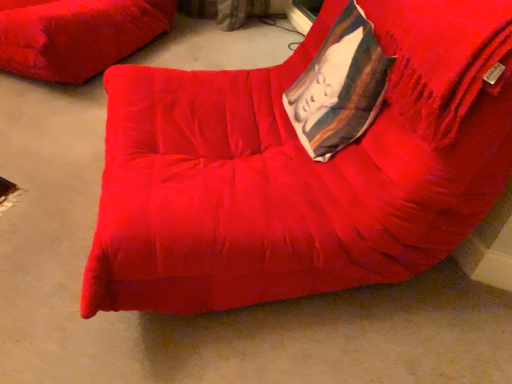
This screenshot has width=512, height=384. I want to click on velvet-like white pillow at upper right, so click(339, 87).

This screenshot has height=384, width=512. What do you see at coordinates (76, 35) in the screenshot? I see `velvet red cushion at upper left, arranged as the 1th furniture when viewed from the back` at bounding box center [76, 35].

Identify the location of velvet-like white pillow at upper right. pos(339,87).

In the scene shown: Is velvet red bean bag chair at center, the 2th furniture in the back-to-front sequence, aimed at velvet red cushion at upper left, which is counted as the 2th furniture, starting from the right?

No.

From a real-world perspective, which is physically below, velvet red bean bag chair at center, marked as the first furniture in a front-to-back arrangement, or velvet red cushion at upper left, which appears as the first furniture when viewed from the left?

velvet red cushion at upper left, which appears as the first furniture when viewed from the left, from a real-world perspective.

Looking at this image, measure the distance between velvet red bean bag chair at center, the 2th furniture in the back-to-front sequence, and velvet red cushion at upper left, which appears as the 2th furniture when viewed from the front.

A distance of 1.15 meters exists between velvet red bean bag chair at center, the 2th furniture in the back-to-front sequence, and velvet red cushion at upper left, which appears as the 2th furniture when viewed from the front.

Does velvet red bean bag chair at center, marked as the 2th furniture in a left-to-right arrangement, have a lesser height compared to velvet red cushion at upper left, arranged as the 1th furniture when viewed from the back?

No.

Is velvet red cushion at upper left, which is counted as the 2th furniture, starting from the right, facing away from velvet-like white pillow at upper right?

velvet red cushion at upper left, which is counted as the 2th furniture, starting from the right, is not turned away from velvet-like white pillow at upper right.

Is velvet red cushion at upper left, which appears as the first furniture when viewed from the left, not near velvet-like white pillow at upper right?

Yes.

From the picture: Considering the positions of objects velvet red cushion at upper left, which is counted as the 2th furniture, starting from the right, and velvet-like white pillow at upper right in the image provided, who is more to the right, velvet red cushion at upper left, which is counted as the 2th furniture, starting from the right, or velvet-like white pillow at upper right?

From the viewer's perspective, velvet-like white pillow at upper right appears more on the right side.

Is velvet red cushion at upper left, arranged as the 1th furniture when viewed from the back, positioned beyond the bounds of velvet-like white pillow at upper right?

Yes, velvet red cushion at upper left, arranged as the 1th furniture when viewed from the back, is located beyond the bounds of velvet-like white pillow at upper right.

From a real-world perspective, which is physically below, velvet-like white pillow at upper right or velvet red bean bag chair at center, which is counted as the 1th furniture, starting from the right?

From a 3D spatial view, velvet red bean bag chair at center, which is counted as the 1th furniture, starting from the right, is below.

Is velvet red bean bag chair at center, which is counted as the 1th furniture, starting from the right, at the back of velvet-like white pillow at upper right?

Correct, velvet-like white pillow at upper right is looking away from velvet red bean bag chair at center, which is counted as the 1th furniture, starting from the right.

Does velvet-like white pillow at upper right have a lesser width compared to velvet red bean bag chair at center, marked as the first furniture in a front-to-back arrangement?

Correct, the width of velvet-like white pillow at upper right is less than that of velvet red bean bag chair at center, marked as the first furniture in a front-to-back arrangement.

Locate an element on the screen. The width and height of the screenshot is (512, 384). furniture in front of the velvet red cushion at upper left, which appears as the 2th furniture when viewed from the front is located at coordinates (304, 161).

From the image's perspective, relative to velvet red bean bag chair at center, marked as the first furniture in a front-to-back arrangement, is velvet red cushion at upper left, which appears as the first furniture when viewed from the left, above or below?

velvet red cushion at upper left, which appears as the first furniture when viewed from the left, is above velvet red bean bag chair at center, marked as the first furniture in a front-to-back arrangement.

Considering the relative sizes of velvet red cushion at upper left, arranged as the 1th furniture when viewed from the back, and velvet red bean bag chair at center, the 2th furniture in the back-to-front sequence, in the image provided, is velvet red cushion at upper left, arranged as the 1th furniture when viewed from the back, smaller than velvet red bean bag chair at center, the 2th furniture in the back-to-front sequence,?

Indeed, velvet red cushion at upper left, arranged as the 1th furniture when viewed from the back, has a smaller size compared to velvet red bean bag chair at center, the 2th furniture in the back-to-front sequence.

From a real-world perspective, is velvet red cushion at upper left, which is counted as the 2th furniture, starting from the right, located higher than velvet red bean bag chair at center, marked as the 2th furniture in a left-to-right arrangement?

Actually, velvet red cushion at upper left, which is counted as the 2th furniture, starting from the right, is physically below velvet red bean bag chair at center, marked as the 2th furniture in a left-to-right arrangement, in the real world.

Based on the photo, are velvet-like white pillow at upper right and velvet red cushion at upper left, arranged as the 1th furniture when viewed from the back, making contact?

velvet-like white pillow at upper right and velvet red cushion at upper left, arranged as the 1th furniture when viewed from the back, are clearly separated.

What's the angular difference between velvet-like white pillow at upper right and velvet red cushion at upper left, which appears as the first furniture when viewed from the left,'s facing directions?

51.7 degrees separate the facing orientations of velvet-like white pillow at upper right and velvet red cushion at upper left, which appears as the first furniture when viewed from the left.

Image resolution: width=512 pixels, height=384 pixels. In order to click on the 2nd furniture to the left of the velvet-like white pillow at upper right, starting your count from the anchor in this screenshot , I will do `click(76, 35)`.

From a real-world perspective, is velvet red bean bag chair at center, marked as the 2th furniture in a left-to-right arrangement, physically below velvet-like white pillow at upper right?

Yes.

Considering the relative sizes of velvet red bean bag chair at center, the 2th furniture in the back-to-front sequence, and velvet-like white pillow at upper right in the image provided, is velvet red bean bag chair at center, the 2th furniture in the back-to-front sequence, taller than velvet-like white pillow at upper right?

Yes.

Consider the image. Could you measure the distance between velvet red bean bag chair at center, marked as the 2th furniture in a left-to-right arrangement, and velvet-like white pillow at upper right?

velvet red bean bag chair at center, marked as the 2th furniture in a left-to-right arrangement, and velvet-like white pillow at upper right are 6.64 inches apart from each other.

Where is `throw pillow above the velvet red bean bag chair at center, marked as the first furniture in a front-to-back arrangement (from a real-world perspective)`? This screenshot has height=384, width=512. throw pillow above the velvet red bean bag chair at center, marked as the first furniture in a front-to-back arrangement (from a real-world perspective) is located at coordinates (339, 87).

Image resolution: width=512 pixels, height=384 pixels. In the image, there is a velvet red bean bag chair at center, marked as the first furniture in a front-to-back arrangement. Identify the location of furniture below it (from a real-world perspective). (76, 35).

Find the location of a particular element. furniture behind the velvet-like white pillow at upper right is located at coordinates (76, 35).

From the image, which object appears to be nearer to velvet red cushion at upper left, arranged as the 1th furniture when viewed from the back, velvet red bean bag chair at center, marked as the first furniture in a front-to-back arrangement, or velvet-like white pillow at upper right?

velvet red bean bag chair at center, marked as the first furniture in a front-to-back arrangement, is closer to velvet red cushion at upper left, arranged as the 1th furniture when viewed from the back.

When comparing their distances from velvet red cushion at upper left, which appears as the first furniture when viewed from the left, does velvet-like white pillow at upper right or velvet red bean bag chair at center, the 2th furniture in the back-to-front sequence, seem further?

velvet-like white pillow at upper right is further to velvet red cushion at upper left, which appears as the first furniture when viewed from the left.

Considering their positions, is velvet red cushion at upper left, arranged as the 1th furniture when viewed from the back, positioned closer to velvet-like white pillow at upper right than velvet red bean bag chair at center, which is counted as the 1th furniture, starting from the right?

velvet red bean bag chair at center, which is counted as the 1th furniture, starting from the right, lies closer to velvet-like white pillow at upper right than the other object.

Based on their spatial positions, is velvet red bean bag chair at center, marked as the 2th furniture in a left-to-right arrangement, or velvet red cushion at upper left, which is counted as the 2th furniture, starting from the right, further from velvet-like white pillow at upper right?

velvet red cushion at upper left, which is counted as the 2th furniture, starting from the right, lies further to velvet-like white pillow at upper right than the other object.

Looking at the image, which one is located closer to velvet red bean bag chair at center, marked as the first furniture in a front-to-back arrangement, velvet-like white pillow at upper right or velvet red cushion at upper left, which is counted as the 2th furniture, starting from the right?

Based on the image, velvet-like white pillow at upper right appears to be nearer to velvet red bean bag chair at center, marked as the first furniture in a front-to-back arrangement.

When comparing their distances from velvet red bean bag chair at center, marked as the first furniture in a front-to-back arrangement, does velvet red cushion at upper left, which appears as the 2th furniture when viewed from the front, or velvet-like white pillow at upper right seem further?

velvet red cushion at upper left, which appears as the 2th furniture when viewed from the front, is positioned further to the anchor velvet red bean bag chair at center, marked as the first furniture in a front-to-back arrangement.

What are the coordinates of `furniture situated between velvet red cushion at upper left, which is counted as the 2th furniture, starting from the right, and velvet-like white pillow at upper right from left to right` in the screenshot? It's located at (304, 161).